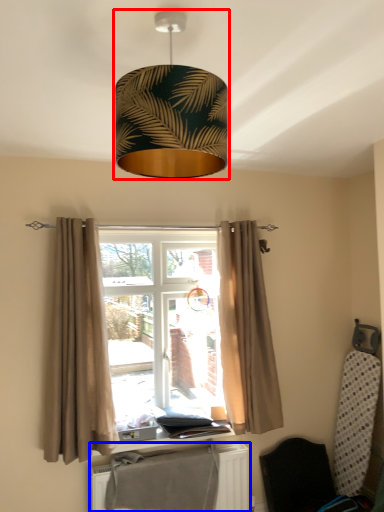
Question: Among these objects, which one is nearest to the camera, lamp (highlighted by a red box) or radiator (highlighted by a blue box)?

Choices:
 (A) lamp
 (B) radiator

Answer: (A)